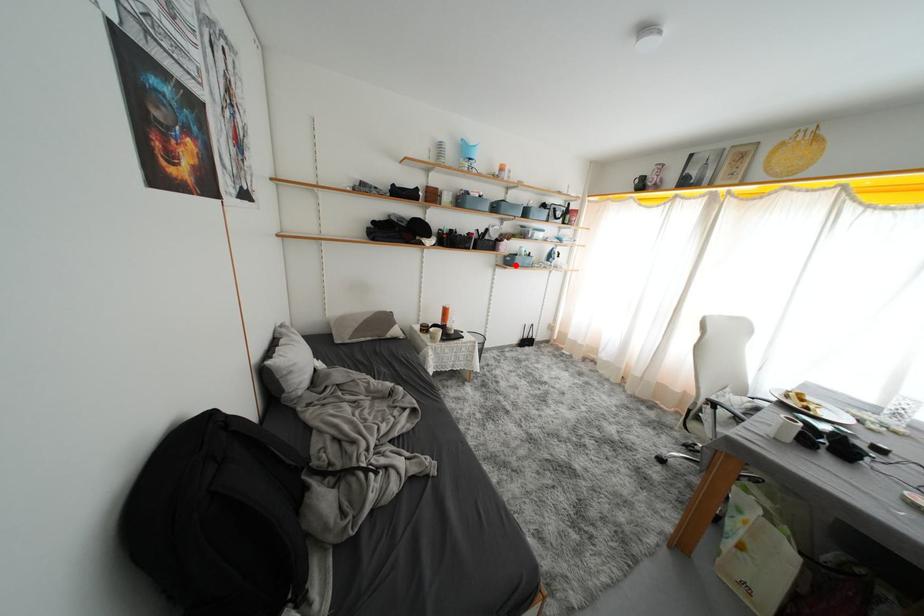
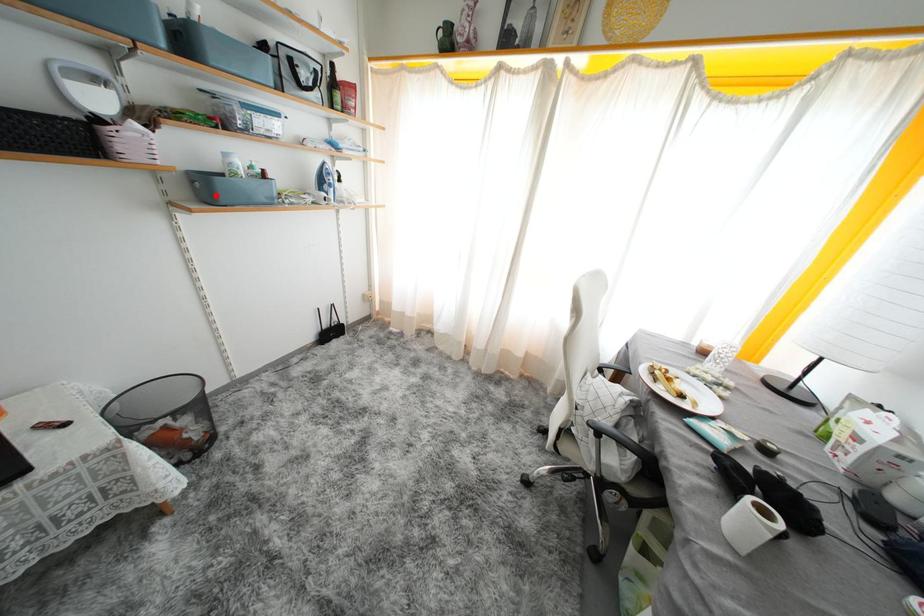
I am providing you with two images of the same scene from different viewpoints. A red point is marked on the first image and another point is marked on the second image. Do the highlighted points in image1 and image2 indicate the same real-world spot?

Yes